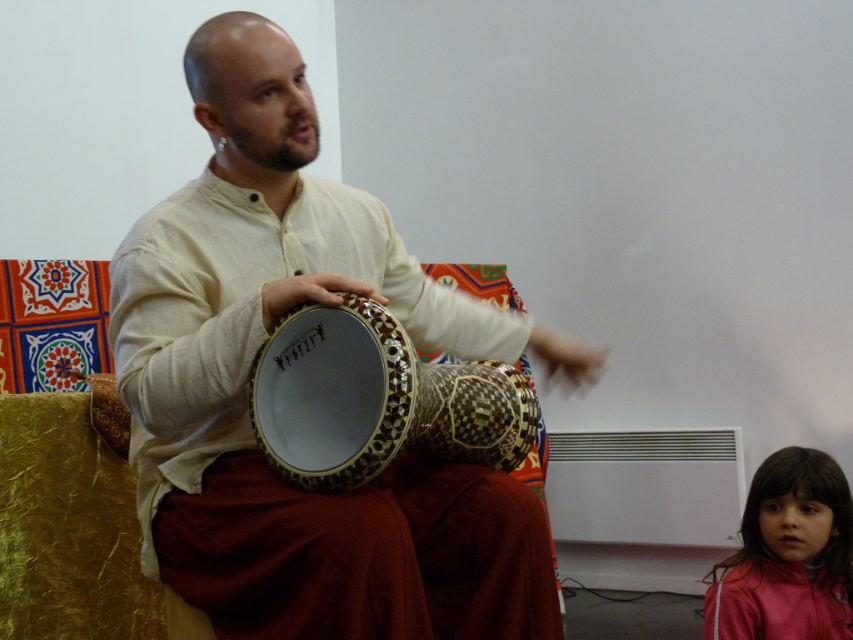
You are standing in the room where the man is playing the matte wooden drum at center. If you want to move closer to the drum, which direction should you walk from your current position?

Since the matte wooden drum at center is located at point 0.606 on the x axis and 0.290 on the y axis, you should walk towards the coordinates of the drum to get closer.

You are a photographer taking a picture of the scene. You want to ensure both the matte wooden drum at center and the shiny pink jacket at lower right are in focus. Which object should you adjust the camera focus on first to ensure both are sharp?

The matte wooden drum at center is much taller than the shiny pink jacket at lower right. To ensure both are in focus, you should focus on the matte wooden drum at center first since it is taller and requires a deeper depth of field.

You are a photographer standing in front of the wooden carved drum at center. You want to capture a closeup shot of the drum without getting too close. What is the minimum distance you need to maintain from the drum to ensure the entire drum fits in your camera frame?

The wooden carved drum at center is 1.37 meters away from the viewer. To capture a closeup shot while maintaining the entire drum in frame, you should stay at least 1.37 meters away from the drum.